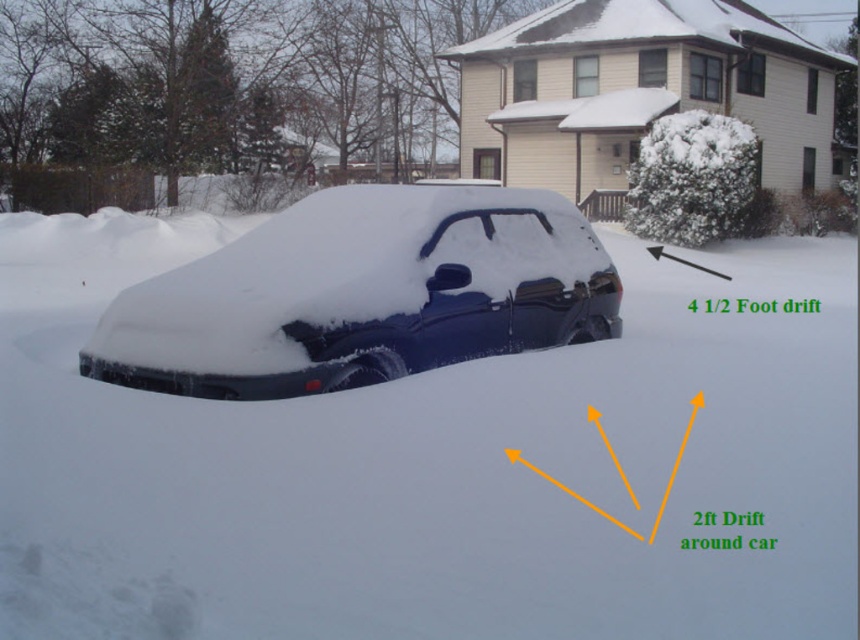
Based on the scene description, where is the white fluffy snow at center located in terms of coordinates?

The white fluffy snow at center is located at coordinates point [434,467].